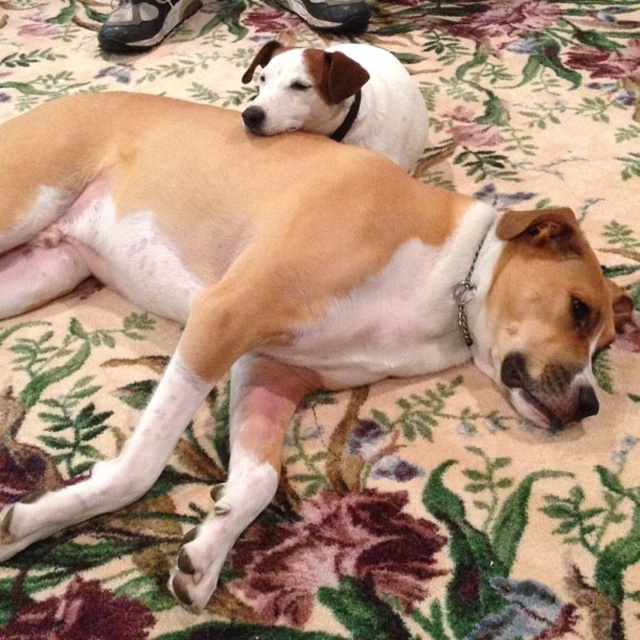
Who is higher up, white matte dog at upper center or metal chain at center?

white matte dog at upper center

You are a GUI agent. You are given a task and a screenshot of the screen. Output one action in this format:
    pyautogui.click(x=<x>, y=<y>)
    Task: Click on the white matte dog at upper center
    This screenshot has width=640, height=640.
    Given the screenshot: What is the action you would take?
    pyautogui.click(x=339, y=97)

Identify the location of white matte dog at upper center. (339, 97).

What do you see at coordinates (141, 22) in the screenshot?
I see `black fabric shoe at upper left` at bounding box center [141, 22].

Looking at this image, who is positioned more to the right, black fabric shoe at upper left or black leather neckband at upper center?

black leather neckband at upper center

The width and height of the screenshot is (640, 640). Identify the location of black fabric shoe at upper left. (141, 22).

Find the location of a particular element. black fabric shoe at upper left is located at coordinates (x=141, y=22).

Which is more to the right, black leather shoe at upper center or black leather neckband at upper center?

From the viewer's perspective, black leather neckband at upper center appears more on the right side.

What do you see at coordinates (330, 13) in the screenshot? The image size is (640, 640). I see `black leather shoe at upper center` at bounding box center [330, 13].

Image resolution: width=640 pixels, height=640 pixels. I want to click on black leather shoe at upper center, so click(x=330, y=13).